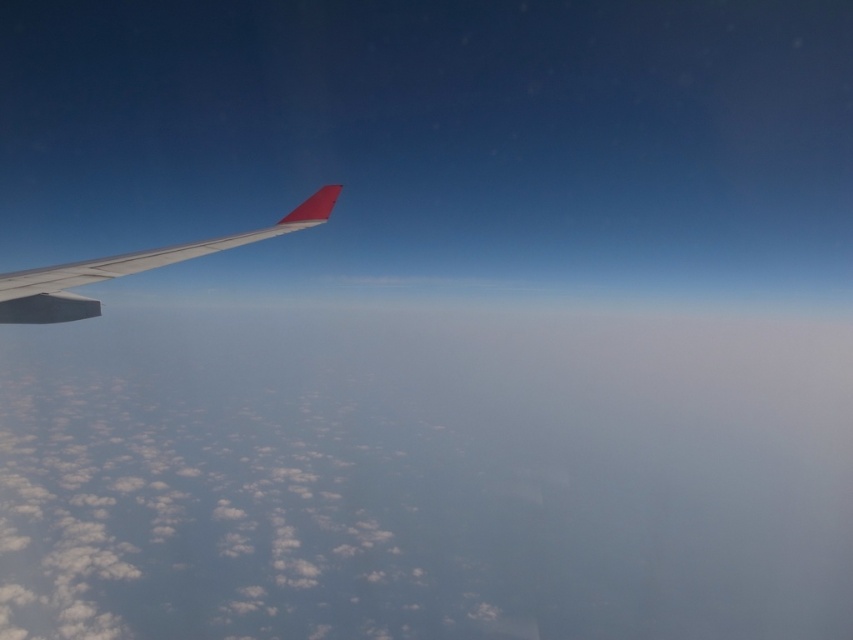
Locate an element on the screen. This screenshot has width=853, height=640. white fluffy cloud at lower left is located at coordinates click(x=424, y=476).

Describe the element at coordinates (424, 476) in the screenshot. I see `white fluffy cloud at lower left` at that location.

Image resolution: width=853 pixels, height=640 pixels. I want to click on white fluffy cloud at lower left, so click(424, 476).

The image size is (853, 640). I want to click on white fluffy cloud at lower left, so click(x=424, y=476).